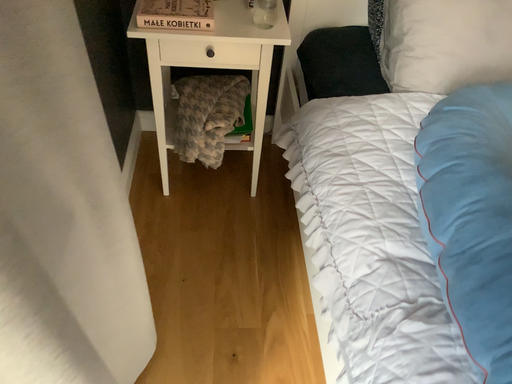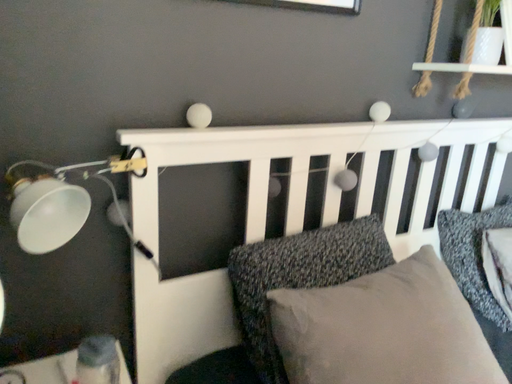
Question: How did the camera likely rotate when shooting the video?

Choices:
 (A) rotated left
 (B) rotated right

Answer: (B)